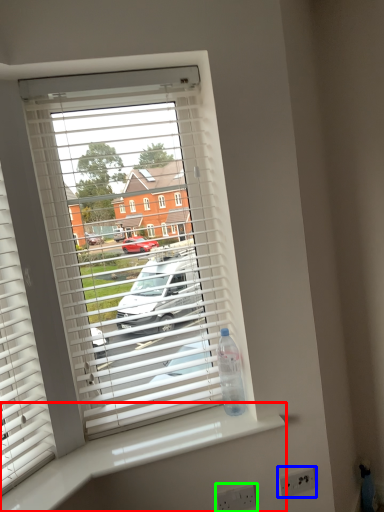
Question: Which is farther away from counter top (highlighted by a red box)? electric outlet (highlighted by a blue box) or electric outlet (highlighted by a green box)?

Choices:
 (A) electric outlet
 (B) electric outlet

Answer: (A)